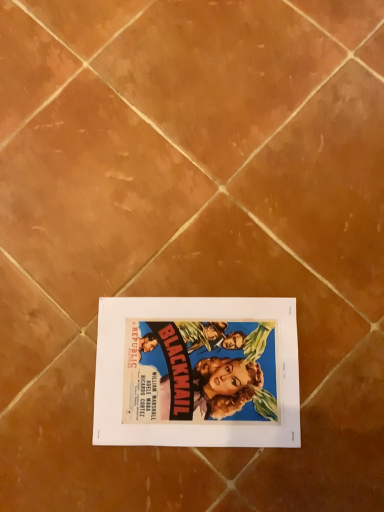
Where is `white paper at center`? The height and width of the screenshot is (512, 384). white paper at center is located at coordinates (197, 372).

The image size is (384, 512). Describe the element at coordinates (197, 372) in the screenshot. I see `white paper at center` at that location.

Where is `white paper at center`? The image size is (384, 512). white paper at center is located at coordinates (197, 372).